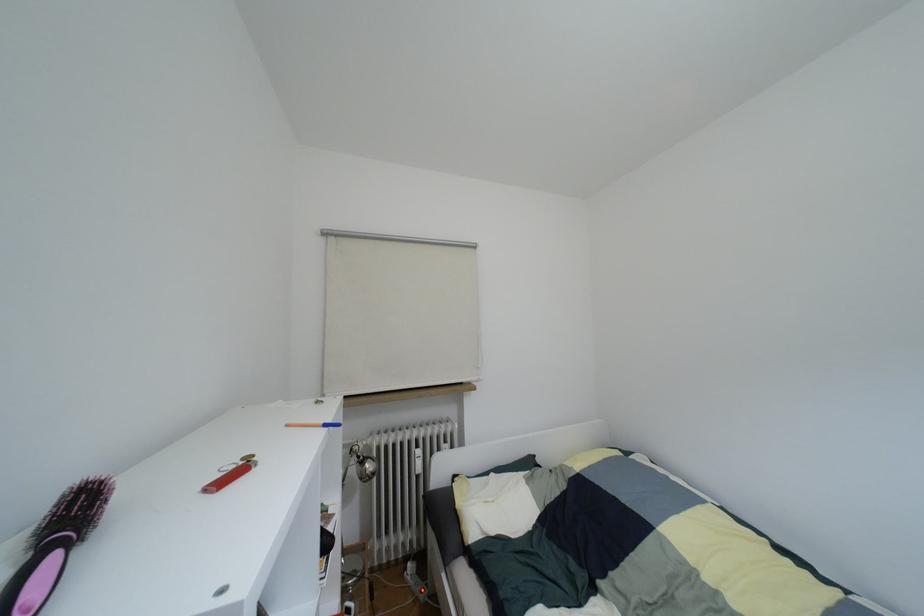
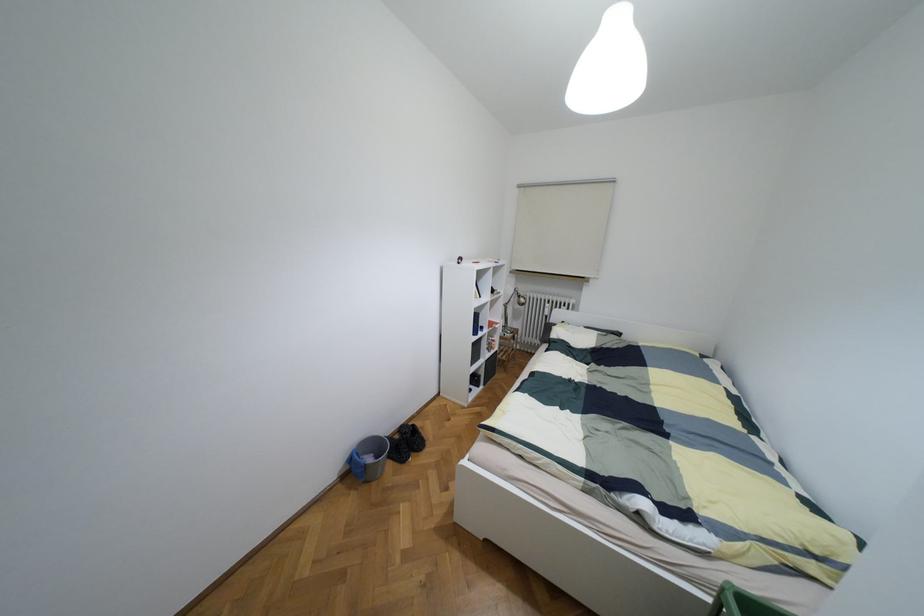
Find the pixel in the second image that matches pixel 360 461 in the first image.

(517, 296)